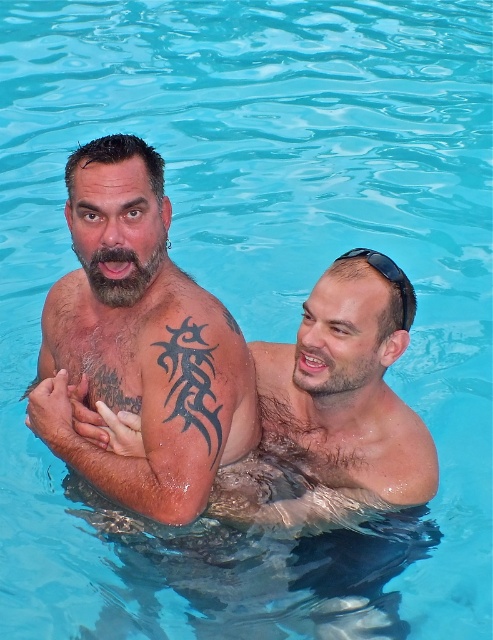
Does dark brown skin tattoo at center appear over black rubber goggles at upper right?

Actually, dark brown skin tattoo at center is below black rubber goggles at upper right.

Is dark brown skin tattoo at center taller than black rubber goggles at upper right?

Yes.

Who is more forward, (105, 326) or (363, 253)?

Positioned in front is point (363, 253).

Where is `dark brown skin tattoo at center`? dark brown skin tattoo at center is located at coordinates (138, 346).